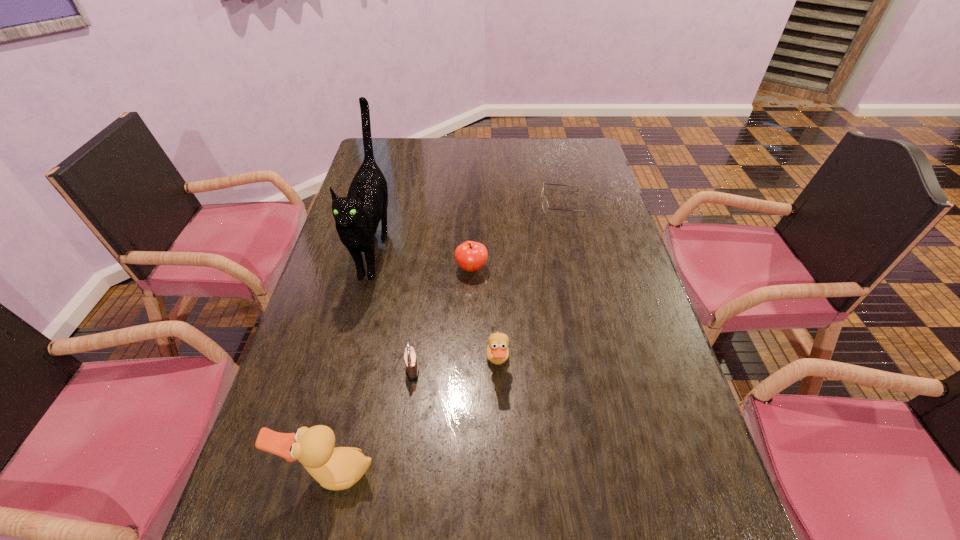
This screenshot has width=960, height=540. What are the coordinates of `the left duck` in the screenshot? It's located at (339, 468).

Locate an element on the screen. This screenshot has height=540, width=960. the second tallest object is located at coordinates (339, 468).

What are the coordinates of `the right duck` in the screenshot? It's located at (497, 352).

At what (x,y) coordinates should I click in order to perform the action: click on the shorter duck. Please return your answer as a coordinate pair (x, y). Looking at the image, I should click on (497, 352).

At what (x,y) coordinates should I click in order to perform the action: click on the tallest object. Please return your answer as a coordinate pair (x, y). Looking at the image, I should click on (357, 216).

Where is `spectacles`? The image size is (960, 540). spectacles is located at coordinates (545, 206).

Find the location of a particular element. The width and height of the screenshot is (960, 540). the rightmost object is located at coordinates (545, 206).

This screenshot has height=540, width=960. In order to click on apple in this screenshot , I will do point(471,256).

Locate an element on the screen. The width and height of the screenshot is (960, 540). the fourth object from right to left is located at coordinates (412, 368).

Identify the location of free space located 0.080m on the beak of the shorter duck. The width and height of the screenshot is (960, 540). (542, 363).